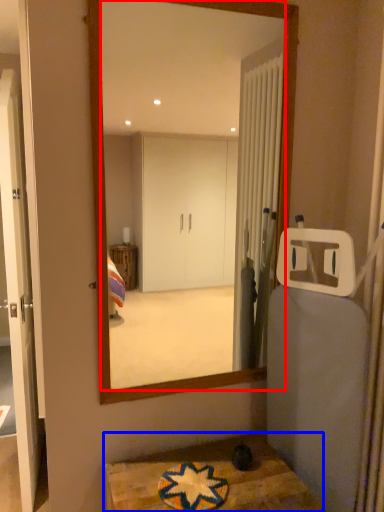
Question: Which object appears farthest to the camera in this image, mirror (highlighted by a red box) or table (highlighted by a blue box)?

Choices:
 (A) mirror
 (B) table

Answer: (A)